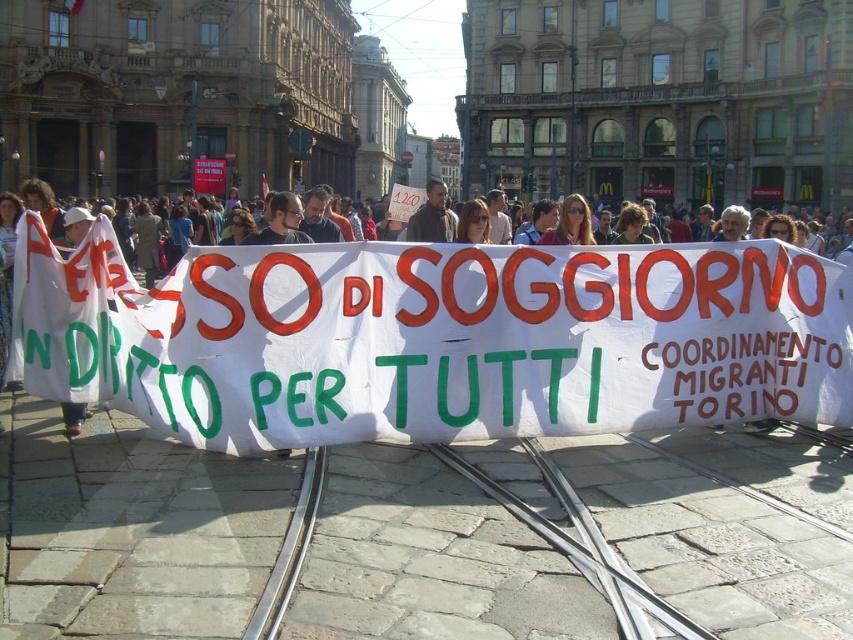
Question: Which object is farther from the camera taking this photo?

Choices:
 (A) white paper banner at center
 (B) matte black sign at center

Answer: (B)

Question: Does white paper banner at center have a smaller size compared to matte black sign at center?

Choices:
 (A) yes
 (B) no

Answer: (B)

Question: Does white paper banner at center appear under matte black sign at center?

Choices:
 (A) no
 (B) yes

Answer: (B)

Question: Can you confirm if white paper banner at center is positioned above matte black sign at center?

Choices:
 (A) no
 (B) yes

Answer: (A)

Question: Which of the following is the closest to the observer?

Choices:
 (A) white paper banner at center
 (B) matte black sign at center

Answer: (A)